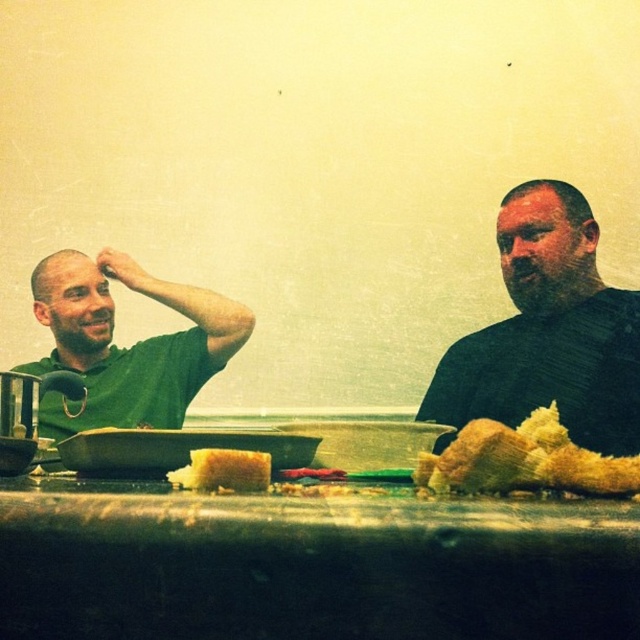
Between dark green sweater at right and golden crispy bread at right, which one has less height?

golden crispy bread at right

Is point (634, 291) farther from viewer compared to point (540, 435)?

That is True.

Which is behind, point (564, 186) or point (552, 461)?

The point (564, 186) is more distant.

The image size is (640, 640). I want to click on dark green sweater at right, so click(548, 332).

Which is more to the right, shiny metallic table at center or dark green sweater at right?

dark green sweater at right is more to the right.

Which is behind, point (502, 568) or point (568, 355)?

The point (568, 355) is more distant.

You are a GUI agent. You are given a task and a screenshot of the screen. Output one action in this format:
    pyautogui.click(x=<x>, y=<y>)
    Task: Click on the shiny metallic table at center
    The height and width of the screenshot is (640, 640).
    Given the screenshot: What is the action you would take?
    tap(310, 566)

Which is more to the left, golden crispy bread at right or yellow crumbly bread at center?

yellow crumbly bread at center is more to the left.

Is golden crispy bread at right above yellow crumbly bread at center?

Correct, golden crispy bread at right is located above yellow crumbly bread at center.

Find the location of a particular element. golden crispy bread at right is located at coordinates (524, 460).

The width and height of the screenshot is (640, 640). I want to click on golden crispy bread at right, so click(x=524, y=460).